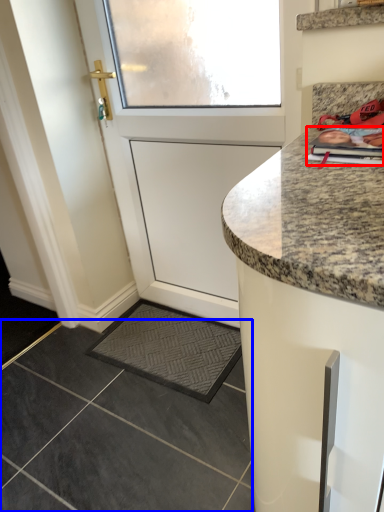
Question: Among these objects, which one is nearest to the camera, magazine (highlighted by a red box) or granite (highlighted by a blue box)?

Choices:
 (A) magazine
 (B) granite

Answer: (A)